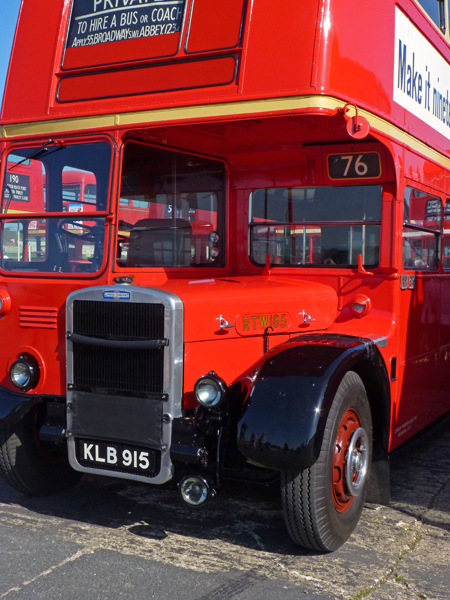
Locate an element on the screen. window is located at coordinates point(270,247), point(272,207), point(336,209), point(80,233), point(61,176), point(412,245), point(419,209), point(144,236), point(200,220).